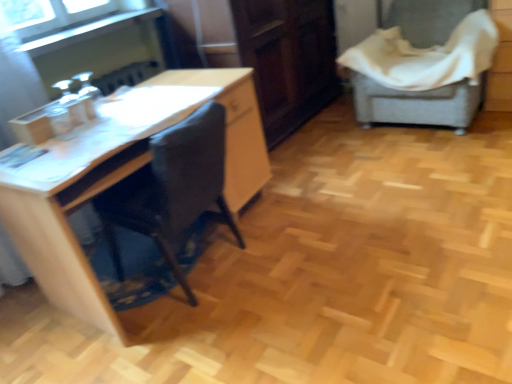
Question: Relative to dark wood/file cabinet at center, is wooden desk at left in front or behind?

Choices:
 (A) behind
 (B) front

Answer: (B)

Question: In terms of size, does wooden desk at left appear bigger or smaller than dark wood/file cabinet at center?

Choices:
 (A) small
 (B) big

Answer: (A)

Question: Estimate the real-world distances between objects in this image. Which object is farther from the wooden desk at left?

Choices:
 (A) gray fabric-covered chair at right
 (B) dark wood/file cabinet at center
 (C) clear glass window at upper left

Answer: (A)

Question: Estimate the real-world distances between objects in this image. Which object is closer to the gray fabric-covered chair at right?

Choices:
 (A) wooden desk at left
 (B) dark wood/file cabinet at center
 (C) clear glass window at upper left

Answer: (B)